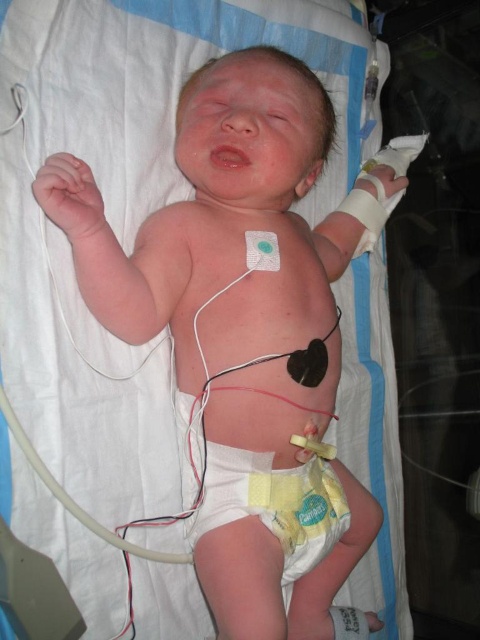
Find the location of `yellow cloth diaper at center`. yellow cloth diaper at center is located at coordinates (273, 502).

Is point (266, 460) positioned after point (75, 163)?

That is True.

Identify the location of yellow cloth diaper at center. This screenshot has height=640, width=480. (273, 502).